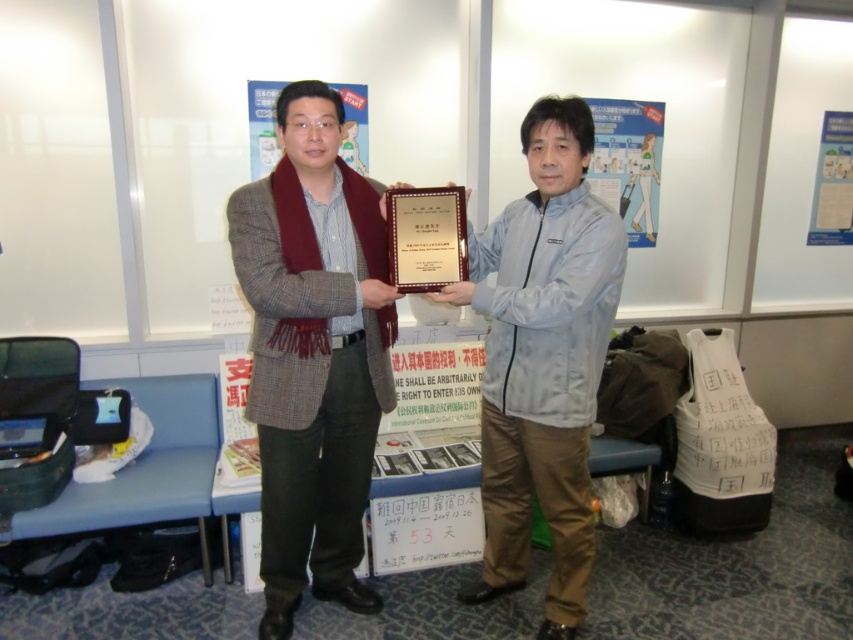
Question: Which of the following is the closest to the observer?

Choices:
 (A) matte gold plaque at center
 (B) light blue fabric jacket at center

Answer: (B)

Question: Can you confirm if light blue fabric jacket at center is positioned above matte gold plaque at center?

Choices:
 (A) yes
 (B) no

Answer: (B)

Question: Which object is closer to the camera taking this photo?

Choices:
 (A) plaid wool coat at center
 (B) light blue fabric jacket at center

Answer: (A)

Question: Is plaid wool coat at center in front of matte gold plaque at center?

Choices:
 (A) no
 (B) yes

Answer: (B)

Question: Which object is the farthest from the plaid wool coat at center?

Choices:
 (A) matte gold plaque at center
 (B) light blue fabric jacket at center

Answer: (B)

Question: Is plaid wool coat at center positioned in front of light blue fabric jacket at center?

Choices:
 (A) yes
 (B) no

Answer: (A)